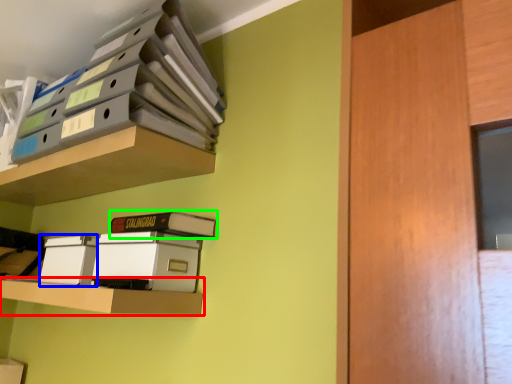
Question: Which is nearer to the shelf (highlighted by a red box)? storage box (highlighted by a blue box) or paperback book (highlighted by a green box).

Choices:
 (A) storage box
 (B) paperback book

Answer: (A)